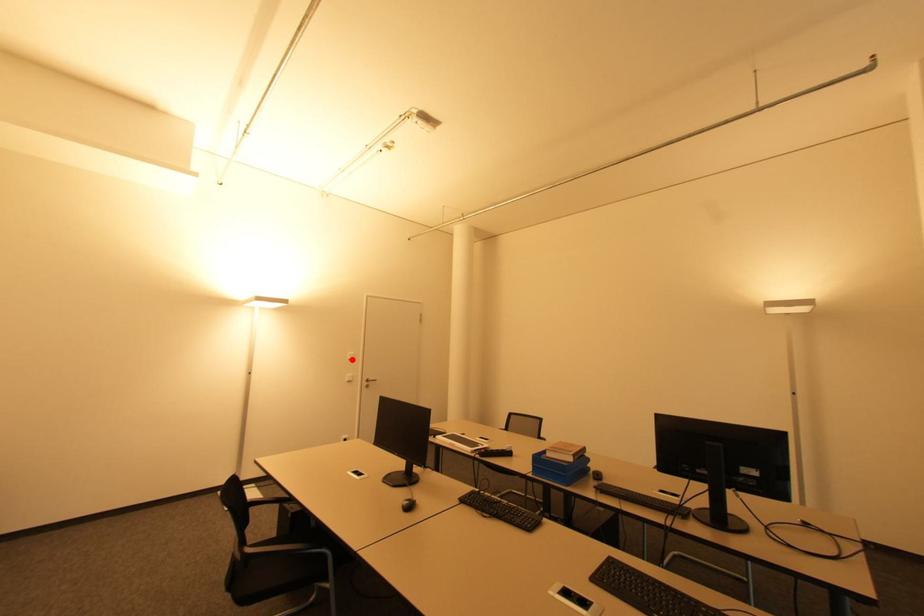
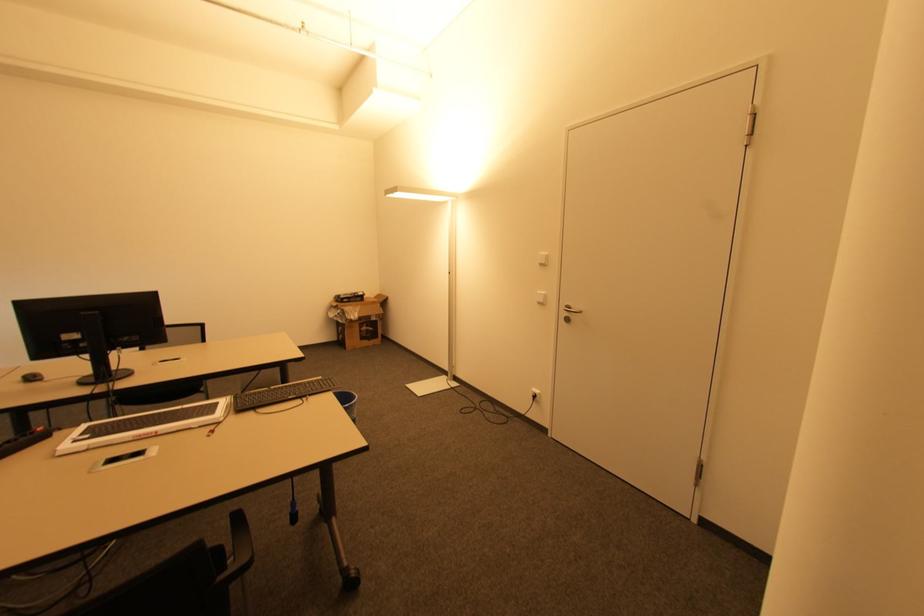
Where in the second image is the point corresponding to the highlighted location from the first image?

(542, 265)